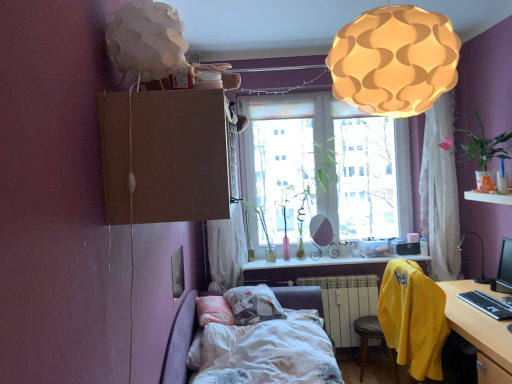
In order to click on free area below black plastic keyboard at lower right (from a real-world perspective) in this screenshot , I will do [487, 299].